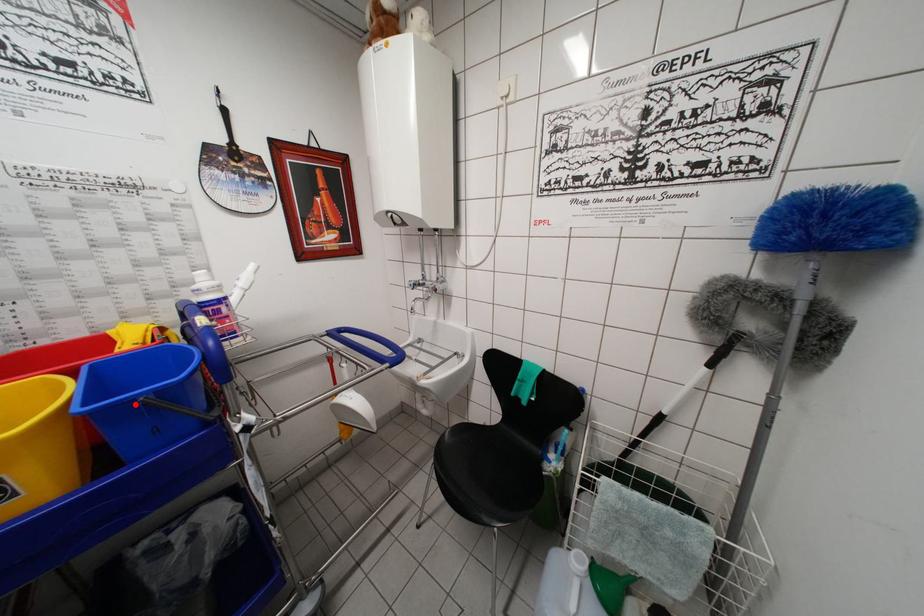
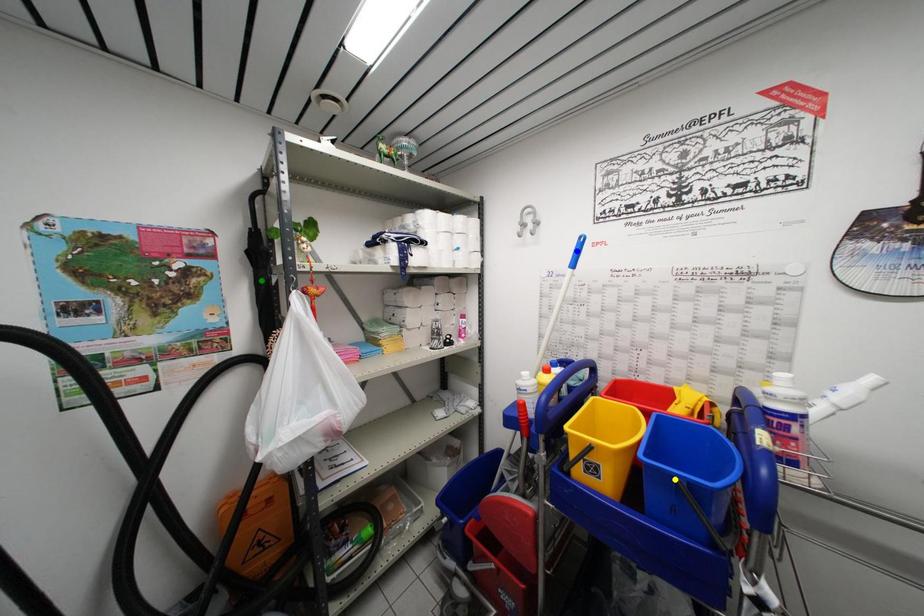
Question: I am providing you with two images of the same scene from different viewpoints. A red point is marked on the first image. You are given multiple points on the second image. Which mark in image 2 goes with the point in image 1?

Choices:
 (A) green point
 (B) blue point
 (C) yellow point

Answer: (C)